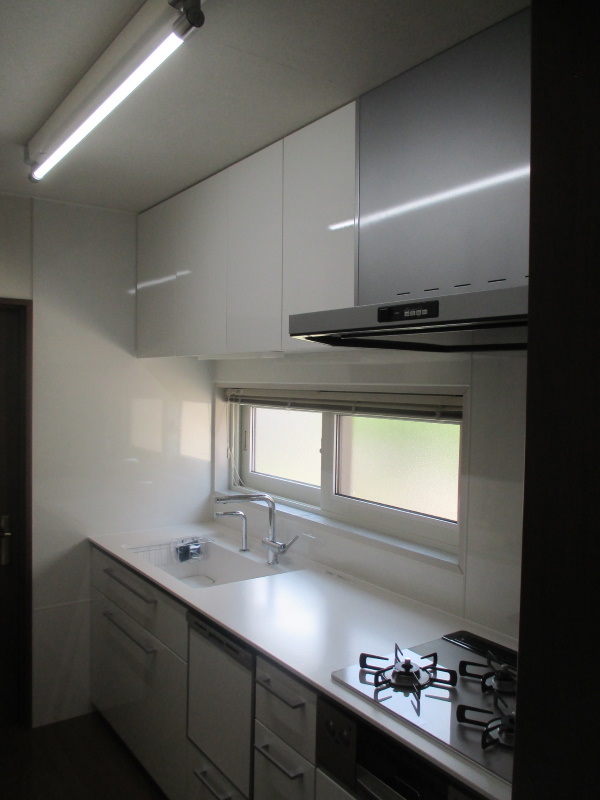
Where is `windows`? This screenshot has height=800, width=600. windows is located at coordinates (280, 445), (395, 458).